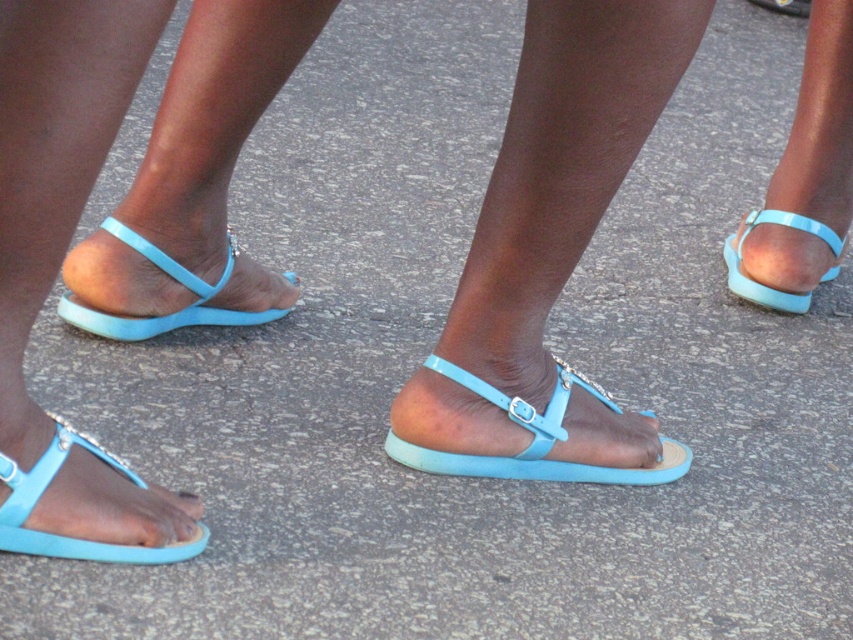
Does matte blue sandal at lower left have a greater height compared to matte blue sandal at right?

No, matte blue sandal at lower left is not taller than matte blue sandal at right.

Does point (157, 257) lie behind point (750, 298)?

No, (157, 257) is closer to viewer.

Where is `matte blue sandal at lower left`? The image size is (853, 640). matte blue sandal at lower left is located at coordinates (167, 314).

Does matte blue sandal at center have a smaller size compared to matte blue sandal at right?

No.

Which of these two, matte blue sandal at center or matte blue sandal at right, stands taller?

Standing taller between the two is matte blue sandal at right.

In order to click on matte blue sandal at center in this screenshot , I will do `click(534, 438)`.

Who is shorter, matte blue thong sandal at lower left or matte blue sandal at lower left?

matte blue thong sandal at lower left

Is matte blue thong sandal at lower left thinner than matte blue sandal at lower left?

Correct, matte blue thong sandal at lower left's width is less than matte blue sandal at lower left's.

Describe the element at coordinates (68, 536) in the screenshot. The width and height of the screenshot is (853, 640). I see `matte blue thong sandal at lower left` at that location.

This screenshot has height=640, width=853. In order to click on matte blue thong sandal at lower left in this screenshot , I will do `click(68, 536)`.